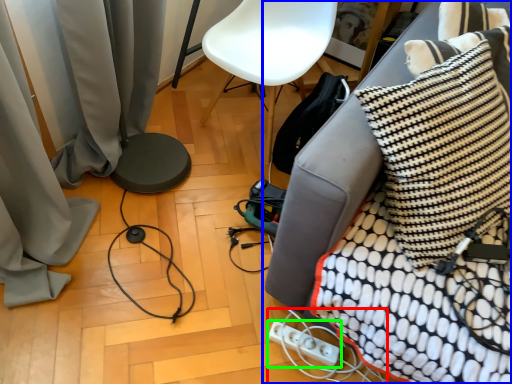
Question: Estimate the real-world distances between objects in this image. Which object is closer to extension cord (highlighted by a red box), furniture (highlighted by a blue box) or electric outlet (highlighted by a green box)?

Choices:
 (A) furniture
 (B) electric outlet

Answer: (B)